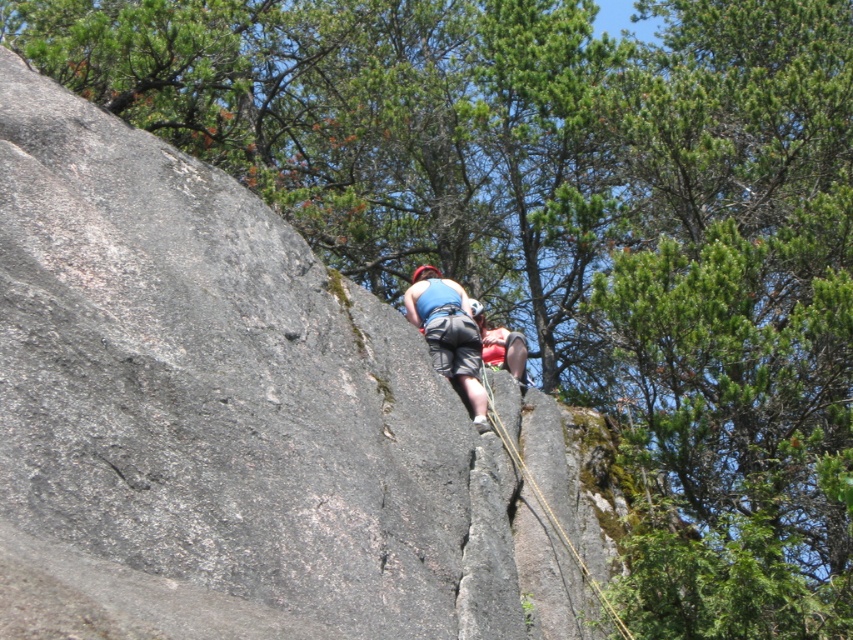
You are a climber preparing to ascend the rock face. You notice the blue fabric harness at center and the yellow rope at center. Which object is positioned to the left when viewed from your climbing perspective?

The blue fabric harness at center is to the left of the yellow rope at center.

You are a climber looking at the rock face and see two points marked on it. One is at point (x=480, y=392) and the other at point (x=521, y=460). Which point is closer to you?

Point (x=521, y=460) is closer to you because it is in front of point (x=480, y=392).